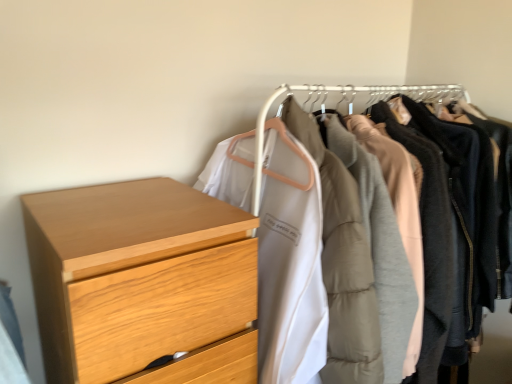
Question: Could you tell me if light wood chest of drawers at left is turned towards matte white coat at center?

Choices:
 (A) yes
 (B) no

Answer: (B)

Question: Can you confirm if light wood chest of drawers at left is positioned to the left of matte white coat at center?

Choices:
 (A) yes
 (B) no

Answer: (A)

Question: Can you confirm if light wood chest of drawers at left is shorter than matte white coat at center?

Choices:
 (A) yes
 (B) no

Answer: (A)

Question: Does light wood chest of drawers at left have a larger size compared to matte white coat at center?

Choices:
 (A) no
 (B) yes

Answer: (A)

Question: Can you confirm if light wood chest of drawers at left is thinner than matte white coat at center?

Choices:
 (A) no
 (B) yes

Answer: (B)

Question: From the image's perspective, is light wood chest of drawers at left below matte white coat at center?

Choices:
 (A) yes
 (B) no

Answer: (A)

Question: Is matte white coat at center positioned in front of light wood chest of drawers at left?

Choices:
 (A) yes
 (B) no

Answer: (B)

Question: From a real-world perspective, is matte white coat at center located higher than light wood chest of drawers at left?

Choices:
 (A) no
 (B) yes

Answer: (A)

Question: Is matte white coat at center not within light wood chest of drawers at left?

Choices:
 (A) no
 (B) yes

Answer: (B)

Question: Can you confirm if matte white coat at center is positioned to the left of light wood chest of drawers at left?

Choices:
 (A) no
 (B) yes

Answer: (A)

Question: Is matte white coat at center not near light wood chest of drawers at left?

Choices:
 (A) yes
 (B) no

Answer: (B)

Question: Is matte white coat at center next to light wood chest of drawers at left?

Choices:
 (A) yes
 (B) no

Answer: (B)

Question: Is point (371, 87) positioned closer to the camera than point (74, 203)?

Choices:
 (A) closer
 (B) farther

Answer: (B)